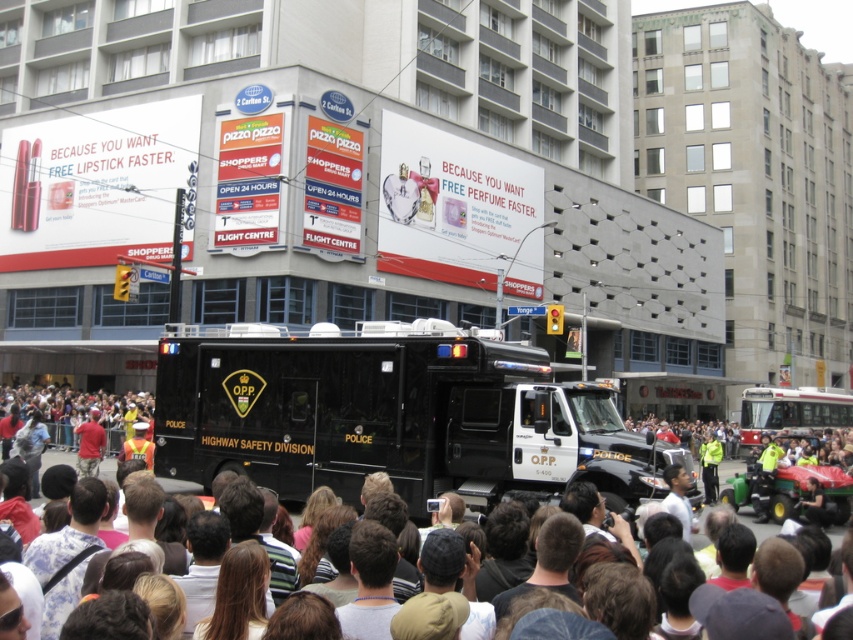
You are a photographer at the event and want to capture a photo of the dark brown hair at center and the yellow reflective vest at center. Which object should you focus on first if you want to include both in the frame without moving the camera?

The dark brown hair at center should be focused on first because it is positioned to the left of the yellow reflective vest at center, so adjusting the frame to include both would require ensuring the left side is captured first.

You are a photographer at the event and want to capture both the red shirt at center and the yellow reflective vest at center in a single shot. Which object should you position closer to the left side of your camera frame to ensure both are visible?

To ensure both the red shirt at center and the yellow reflective vest at center are visible, position the red shirt at center closer to the left side of your camera frame since it is already to the left of the yellow reflective vest at center.

You are a photographer standing at the center of the scene. You want to take a photo that includes both the point at coordinates point (367, 380) and point (701, 470). Which point will appear larger in your photo?

Point (367, 380) will appear larger in the photo because it is closer to the camera than point (701, 470).